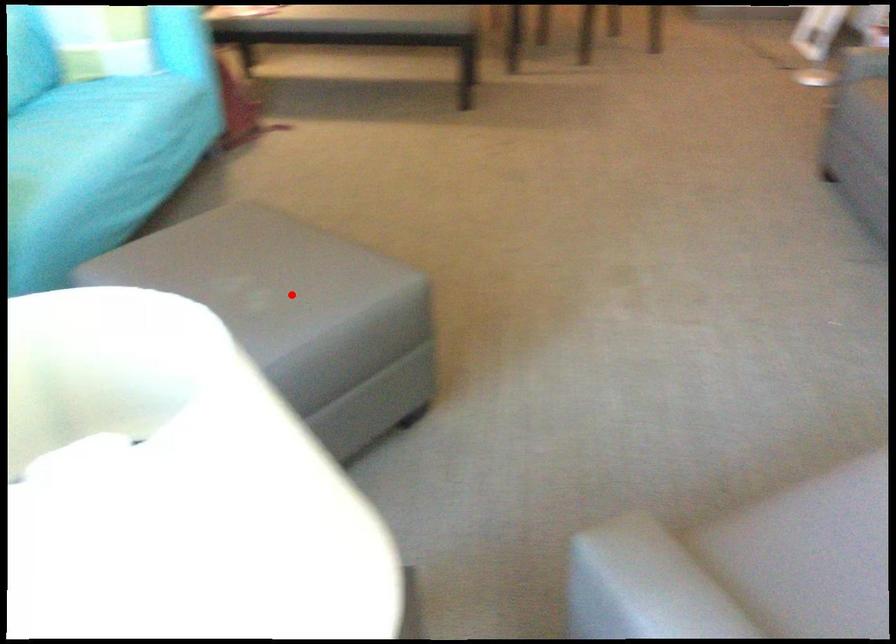
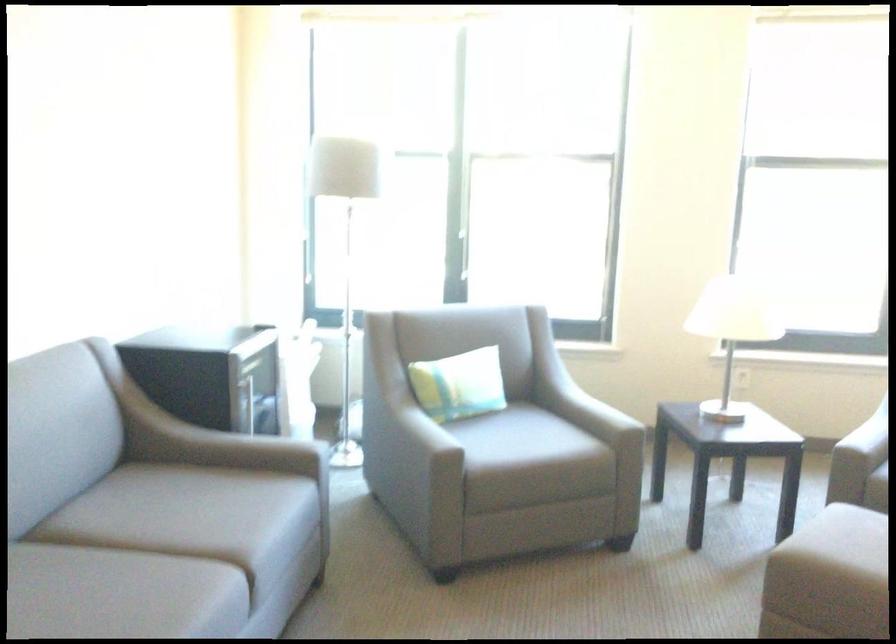
Locate, in the second image, the point that corresponds to the highlighted location in the first image.

(849, 536)